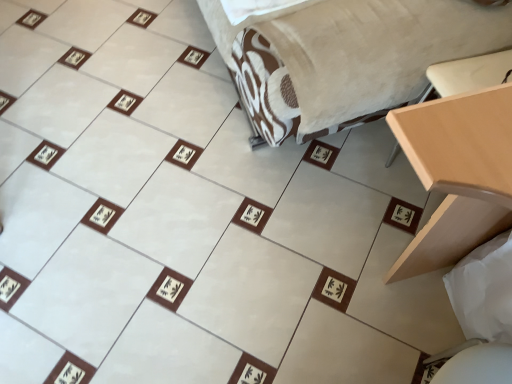
From the picture: Measure the distance between light wood table at right and camera.

A distance of 57.61 centimeters exists between light wood table at right and camera.

In order to click on velvet beige bed at center in this screenshot , I will do `click(342, 56)`.

Identify the location of white fabric sheet at lower right. (484, 290).

Consider the image. Considering the relative sizes of velvet beige bed at center and light wood table at right in the image provided, is velvet beige bed at center thinner than light wood table at right?

Incorrect, the width of velvet beige bed at center is not less than that of light wood table at right.

Which of these two, velvet beige bed at center or light wood table at right, is smaller?

light wood table at right.

Is velvet beige bed at center oriented away from light wood table at right?

No, velvet beige bed at center's orientation is not away from light wood table at right.

From the image's perspective, which is above, white fabric sheet at lower right or velvet beige bed at center?

From the image's view, velvet beige bed at center is above.

How distant is white fabric sheet at lower right from velvet beige bed at center?

A distance of 64.05 centimeters exists between white fabric sheet at lower right and velvet beige bed at center.

Is white fabric sheet at lower right oriented away from velvet beige bed at center?

No, white fabric sheet at lower right is not facing the opposite direction of velvet beige bed at center.

Between point (472, 251) and point (416, 78), which one is positioned in front?

The point (416, 78) is in front.

From the picture: Is white fabric sheet at lower right inside the boundaries of light wood table at right, or outside?

white fabric sheet at lower right exists outside the volume of light wood table at right.

Which of these two, white fabric sheet at lower right or light wood table at right, is wider?

light wood table at right is wider.

In the scene shown: Between white fabric sheet at lower right and light wood table at right, which one appears on the right side from the viewer's perspective?

From the viewer's perspective, light wood table at right appears more on the right side.

Which is closer, (499, 294) or (504, 164)?

Point (499, 294).

Choose the correct answer: Is light wood table at right inside white fabric sheet at lower right or outside it?

light wood table at right exists outside the volume of white fabric sheet at lower right.

Considering the sizes of objects light wood table at right and white fabric sheet at lower right in the image provided, who is taller, light wood table at right or white fabric sheet at lower right?

With more height is light wood table at right.

Is light wood table at right wider or thinner than white fabric sheet at lower right?

Clearly, light wood table at right has more width compared to white fabric sheet at lower right.

Would you say velvet beige bed at center is outside white fabric sheet at lower right?

That's correct, velvet beige bed at center is outside of white fabric sheet at lower right.

Is velvet beige bed at center aimed at white fabric sheet at lower right?

No, velvet beige bed at center is not facing towards white fabric sheet at lower right.

Can you confirm if velvet beige bed at center is thinner than white fabric sheet at lower right?

Incorrect, the width of velvet beige bed at center is not less than that of white fabric sheet at lower right.

From a real-world perspective, between velvet beige bed at center and white fabric sheet at lower right, who is vertically lower?

In real-world perspective, white fabric sheet at lower right is lower.

Considering the positions of objects light wood table at right and velvet beige bed at center in the image provided, who is more to the left, light wood table at right or velvet beige bed at center?

Positioned to the left is velvet beige bed at center.

Considering the relative sizes of light wood table at right and velvet beige bed at center in the image provided, is light wood table at right shorter than velvet beige bed at center?

No, light wood table at right is not shorter than velvet beige bed at center.

Between light wood table at right and velvet beige bed at center, which one is positioned behind?

velvet beige bed at center is further away from the camera.

Find the location of a particular element. The height and width of the screenshot is (384, 512). table below the velvet beige bed at center (from a real-world perspective) is located at coordinates (457, 174).

Identify the location of furniture to the left of white fabric sheet at lower right. This screenshot has height=384, width=512. (342, 56).

Based on their spatial positions, is white fabric sheet at lower right or light wood table at right closer to velvet beige bed at center?

light wood table at right lies closer to velvet beige bed at center than the other object.

Based on their spatial positions, is light wood table at right or white fabric sheet at lower right closer to velvet beige bed at center?

Among the two, light wood table at right is located nearer to velvet beige bed at center.

Looking at the image, which one is located closer to white fabric sheet at lower right, velvet beige bed at center or light wood table at right?

Among the two, light wood table at right is located nearer to white fabric sheet at lower right.

Considering their positions, is white fabric sheet at lower right positioned further to light wood table at right than velvet beige bed at center?

Among the two, velvet beige bed at center is located further to light wood table at right.

Looking at the image, which one is located further to light wood table at right, velvet beige bed at center or white fabric sheet at lower right?

Based on the image, velvet beige bed at center appears to be further to light wood table at right.

Estimate the real-world distances between objects in this image. Which object is closer to white fabric sheet at lower right, light wood table at right or velvet beige bed at center?

Based on the image, light wood table at right appears to be nearer to white fabric sheet at lower right.

I want to click on table between velvet beige bed at center and white fabric sheet at lower right vertically, so click(457, 174).